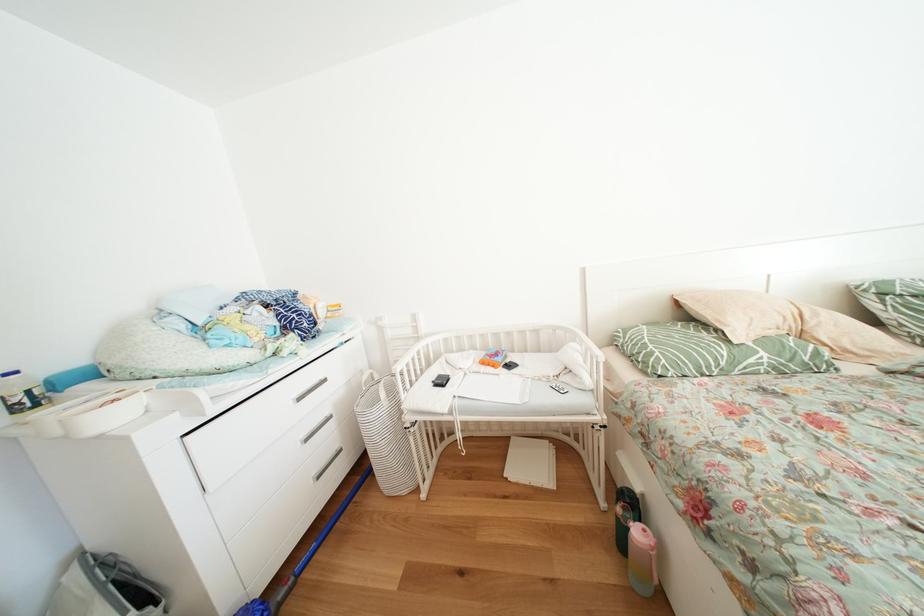
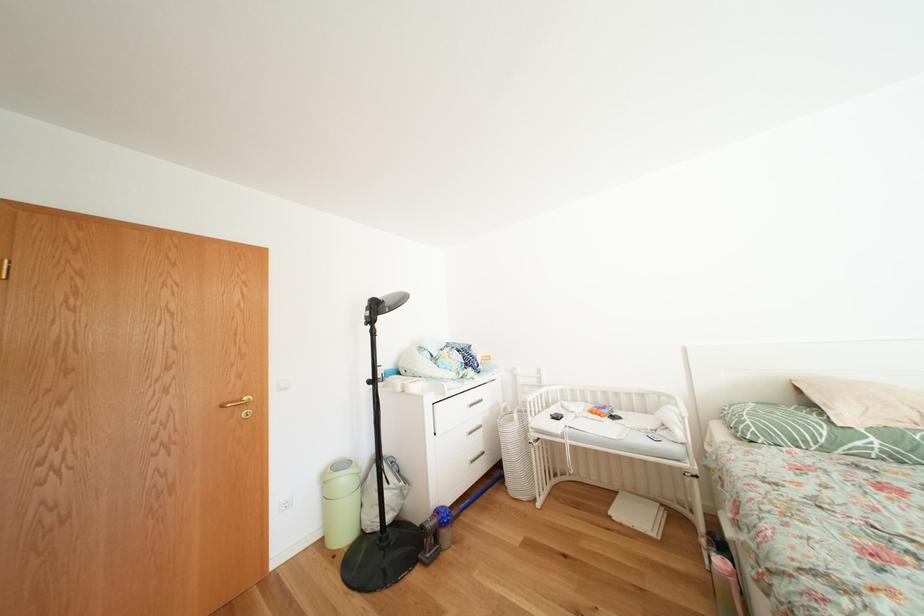
Question: The camera is either moving clockwise (left) or counter-clockwise (right) around the object. The first image is from the beginning of the video and the second image is from the end. Is the camera moving left or right when shooting the video?

Choices:
 (A) Left
 (B) Right

Answer: (B)